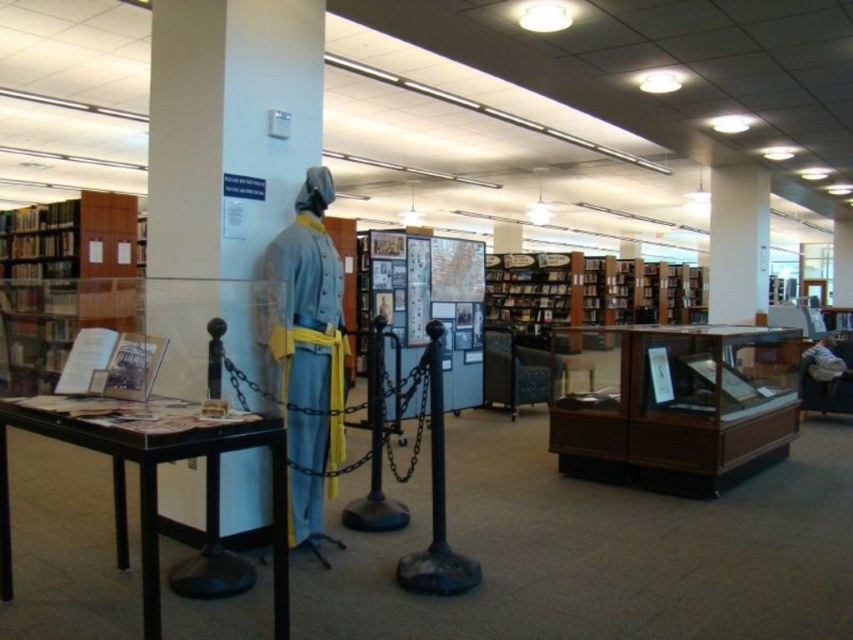
You are standing at the entrance of the library exhibit and need to locate two specific points marked on the floor. The first point is at coordinate point(281, 579) and the second is at point(830, 364). From your vantage point, which point is closer to you?

Point(281, 579) is in front of point(830, 364), so it is closer to you.